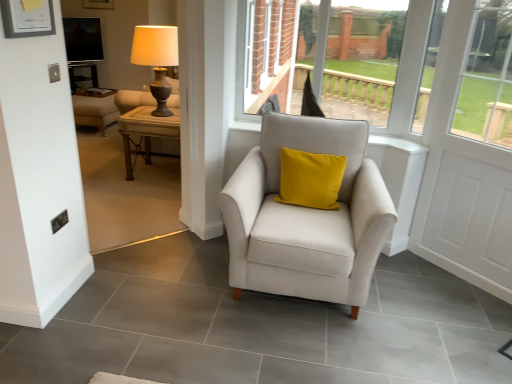
Question: Does woodenmaterial/texturetable at left have a larger size compared to white wooden screen door at right?

Choices:
 (A) yes
 (B) no

Answer: (A)

Question: Considering the relative positions of woodenmaterial/texturetable at left and white wooden screen door at right in the image provided, is woodenmaterial/texturetable at left behind white wooden screen door at right?

Choices:
 (A) yes
 (B) no

Answer: (A)

Question: Would you say white wooden screen door at right is part of woodenmaterial/texturetable at left's contents?

Choices:
 (A) no
 (B) yes

Answer: (A)

Question: From the image's perspective, is woodenmaterial/texturetable at left below white wooden screen door at right?

Choices:
 (A) no
 (B) yes

Answer: (A)

Question: Is woodenmaterial/texturetable at left smaller than white wooden screen door at right?

Choices:
 (A) yes
 (B) no

Answer: (B)

Question: Based on their positions, is satin white armchair at center located to the left or right of matte black screen at upper left?

Choices:
 (A) left
 (B) right

Answer: (B)

Question: From a real-world perspective, is satin white armchair at center above or below matte black screen at upper left?

Choices:
 (A) above
 (B) below

Answer: (B)

Question: Is point (249, 256) closer or farther from the camera than point (96, 34)?

Choices:
 (A) farther
 (B) closer

Answer: (B)

Question: Looking at the image, does satin white armchair at center seem bigger or smaller compared to matte black screen at upper left?

Choices:
 (A) small
 (B) big

Answer: (B)

Question: Would you say matte black screen at upper left is inside or outside woodenmaterial/texturetable at left?

Choices:
 (A) outside
 (B) inside

Answer: (A)

Question: From the image's perspective, relative to woodenmaterial/texturetable at left, is matte black screen at upper left above or below?

Choices:
 (A) below
 (B) above

Answer: (B)

Question: Looking at their shapes, would you say matte black screen at upper left is wider or thinner than woodenmaterial/texturetable at left?

Choices:
 (A) wide
 (B) thin

Answer: (B)

Question: Considering the positions of matte black screen at upper left and woodenmaterial/texturetable at left in the image, is matte black screen at upper left bigger or smaller than woodenmaterial/texturetable at left?

Choices:
 (A) small
 (B) big

Answer: (A)

Question: From a real-world perspective, is matte wood table at left above or below satin white armchair at center?

Choices:
 (A) below
 (B) above

Answer: (B)

Question: In terms of size, does matte wood table at left appear bigger or smaller than satin white armchair at center?

Choices:
 (A) small
 (B) big

Answer: (A)